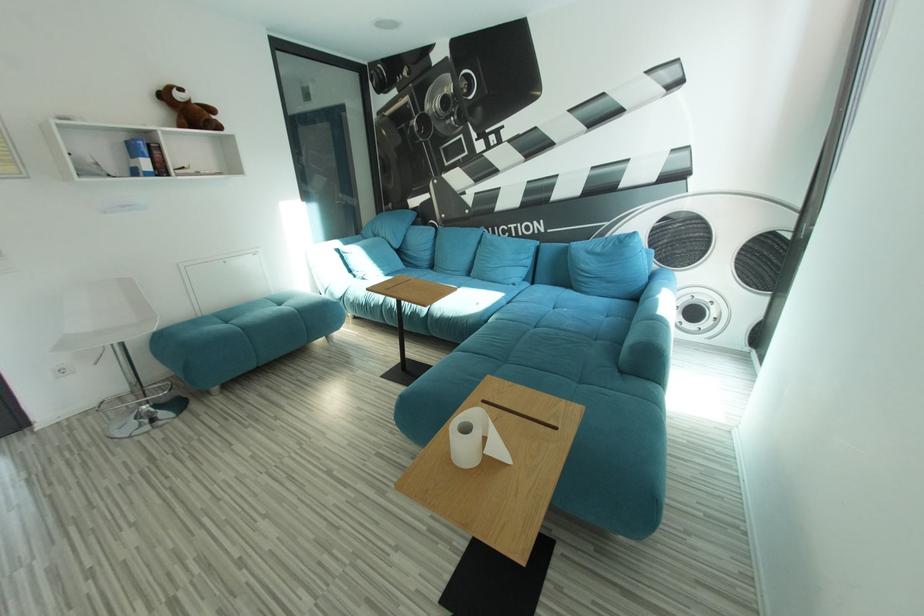
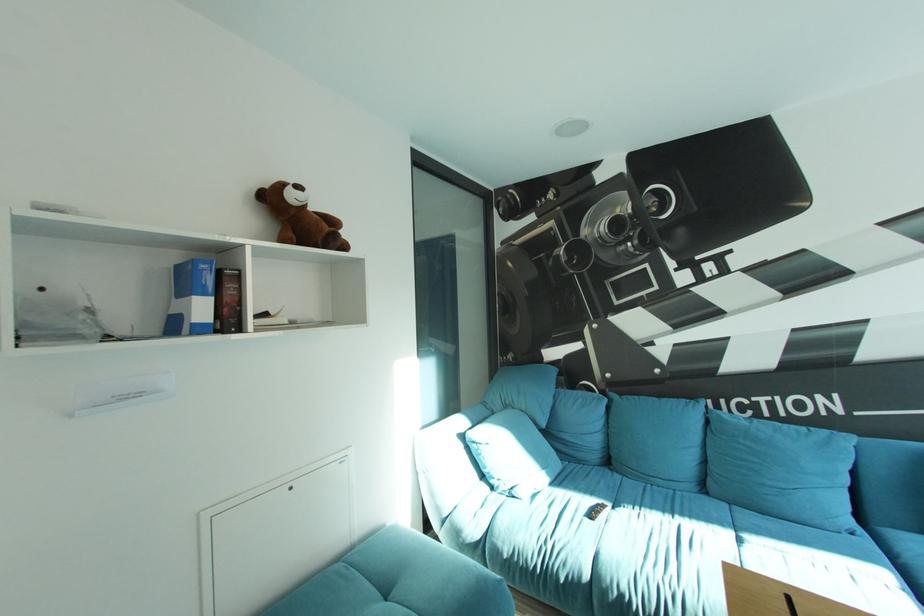
In a continuous first-person perspective shot, in which direction is the camera moving?

The cameraman walked toward left, forward.